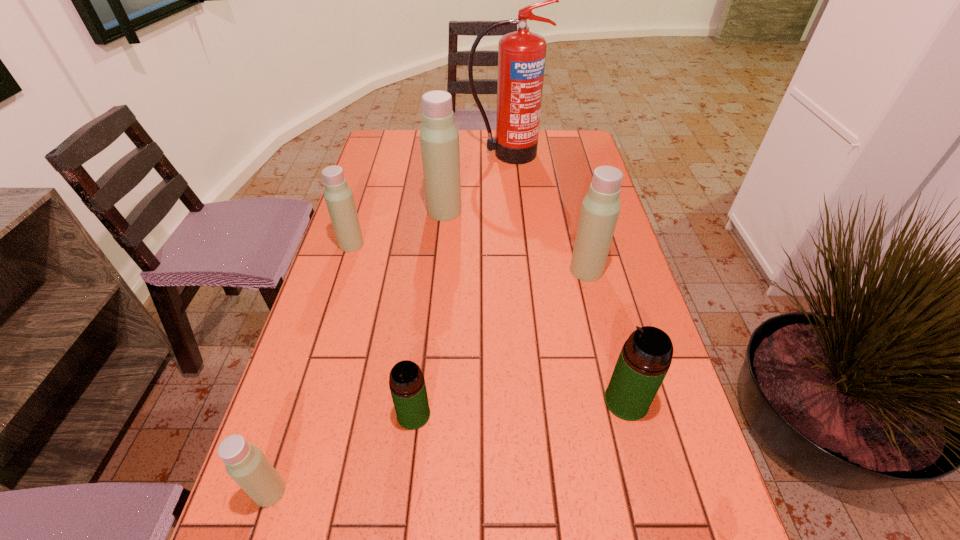
Find the location of a particular element. The image size is (960, 540). free space between the second smallest light thermos bottle and the right green thermos bottle is located at coordinates (489, 322).

Image resolution: width=960 pixels, height=540 pixels. Identify the location of free space between the second smallest light thermos bottle and the right green thermos bottle. (489, 322).

The width and height of the screenshot is (960, 540). What are the coordinates of `object that stands as the third closest to the smaller green thermos bottle` in the screenshot? It's located at (600, 208).

This screenshot has width=960, height=540. In order to click on object identified as the sixth closest to the second farthest thermos bottle in this screenshot , I will do `click(646, 356)`.

Locate which thermos bottle ranks fifth in proximity to the nearest light thermos bottle. Please provide its 2D coordinates. Your answer should be formatted as a tuple, i.e. [(x, y)], where the tuple contains the x and y coordinates of a point satisfying the conditions above.

[(439, 137)]

Where is `thermos bottle that is the second closest to the smaller green thermos bottle`? The image size is (960, 540). thermos bottle that is the second closest to the smaller green thermos bottle is located at coordinates (646, 356).

Identify which light thermos bottle is located as the nearest to the farthest object. Please provide its 2D coordinates. Your answer should be formatted as a tuple, i.e. [(x, y)], where the tuple contains the x and y coordinates of a point satisfying the conditions above.

[(439, 137)]

Identify which light thermos bottle is located as the fourth nearest to the bigger green thermos bottle. Please provide its 2D coordinates. Your answer should be formatted as a tuple, i.e. [(x, y)], where the tuple contains the x and y coordinates of a point satisfying the conditions above.

[(339, 199)]